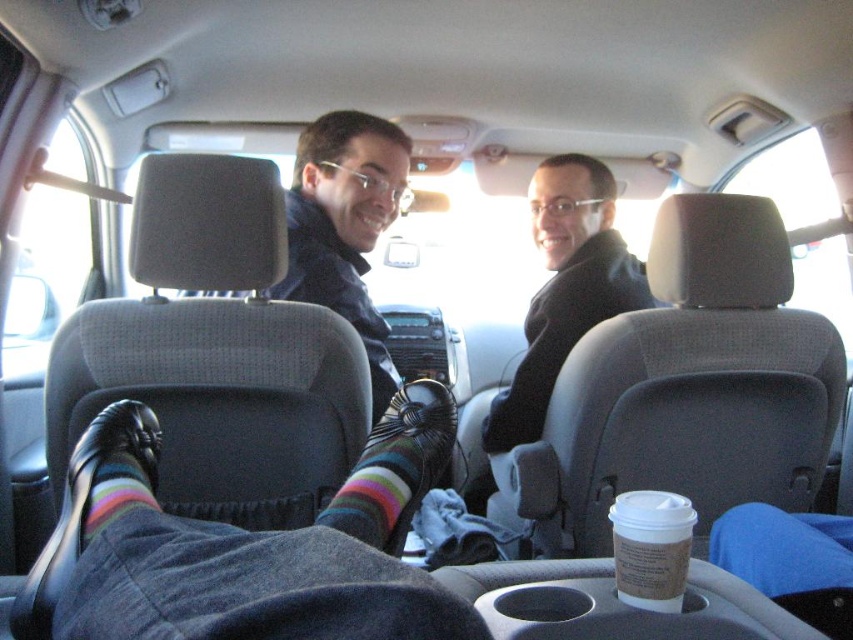
Question: Estimate the real-world distances between objects in this image. Which object is farther from the striped wool sock at center?

Choices:
 (A) black matte jacket at center
 (B) striped wool socks at center
 (C) striped wool sock at lower left
 (D) striped sock at lower left

Answer: (A)

Question: Among these points, which one is farthest from the camera?

Choices:
 (A) (45, 621)
 (B) (144, 493)
 (C) (546, 193)

Answer: (C)

Question: Observing the image, what is the correct spatial positioning of striped wool socks at center in reference to matte black jacket at center?

Choices:
 (A) below
 (B) above

Answer: (A)

Question: Does black matte jacket at center have a lesser width compared to striped wool sock at lower left?

Choices:
 (A) yes
 (B) no

Answer: (B)

Question: Which point is closer to the camera?

Choices:
 (A) striped wool sock at lower left
 (B) matte black jacket at center

Answer: (A)

Question: Does black matte jacket at center appear on the right side of striped sock at lower left?

Choices:
 (A) yes
 (B) no

Answer: (A)